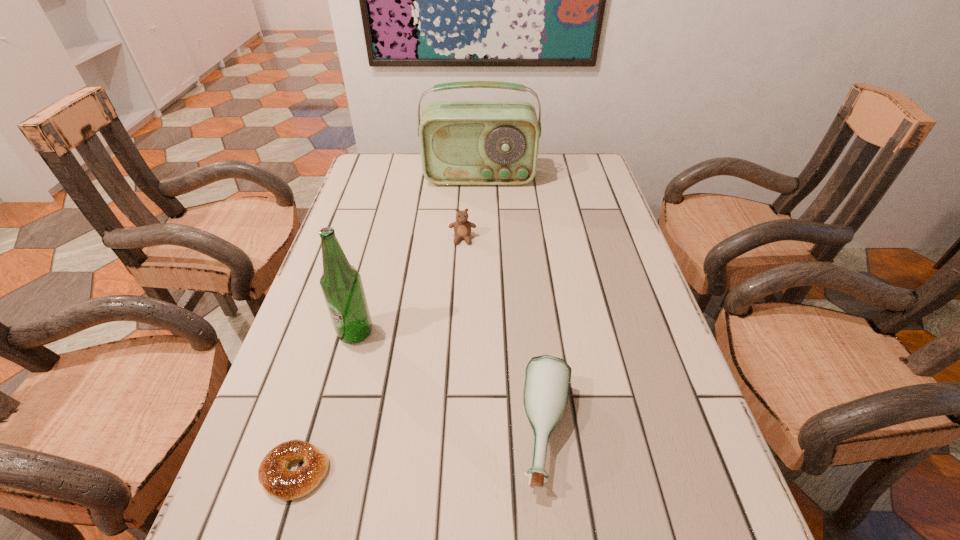
Where is `vacant region that satisfies the following two spatial constraints: 1. on the back side of the bagel; 2. on the right side of the bottle`? This screenshot has width=960, height=540. vacant region that satisfies the following two spatial constraints: 1. on the back side of the bagel; 2. on the right side of the bottle is located at coordinates pyautogui.click(x=307, y=433).

Image resolution: width=960 pixels, height=540 pixels. Identify the location of vacant area in the image that satisfies the following two spatial constraints: 1. on the label of the third farthest object; 2. on the left side of the bottle. (329, 433).

This screenshot has width=960, height=540. I want to click on vacant region that satisfies the following two spatial constraints: 1. on the front panel of the farthest object; 2. on the left side of the bottle, so click(x=479, y=433).

The image size is (960, 540). What are the coordinates of `free location that satisfies the following two spatial constraints: 1. on the label of the third nearest object; 2. on the left side of the bottle` in the screenshot? It's located at (329, 433).